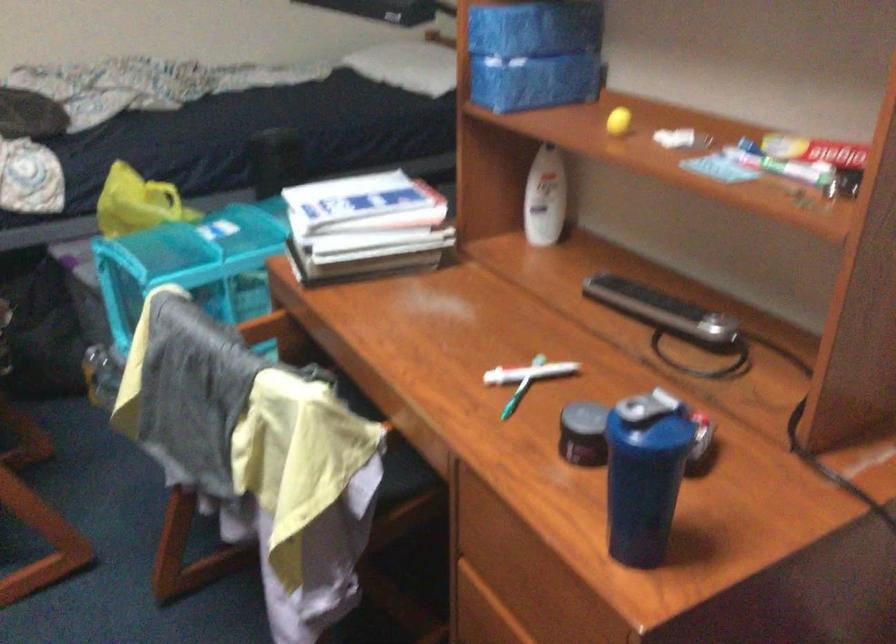
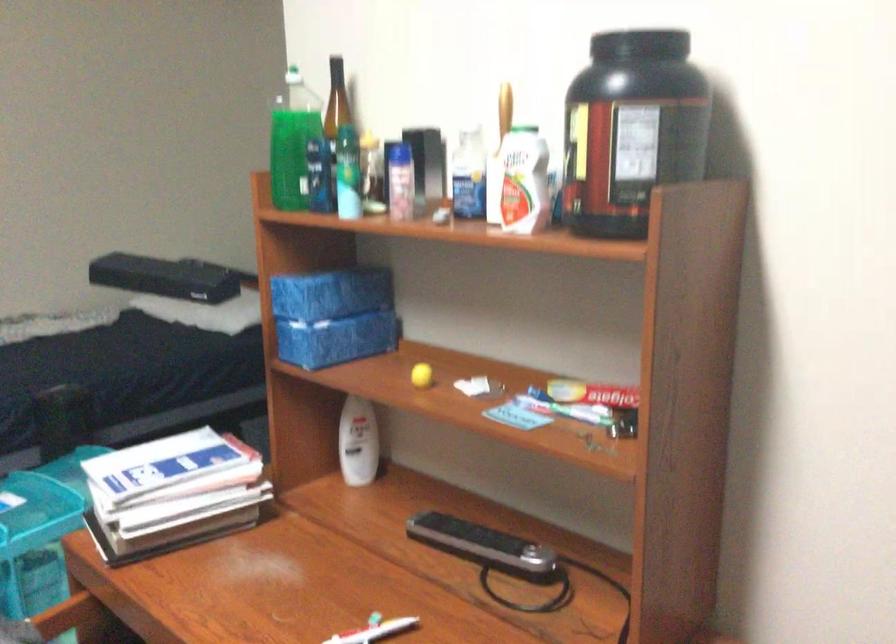
Question: The images are taken continuously from a first-person perspective. In which direction is your viewpoint rotating?

Choices:
 (A) Left
 (B) Right
 (C) Up
 (D) Down

Answer: (B)